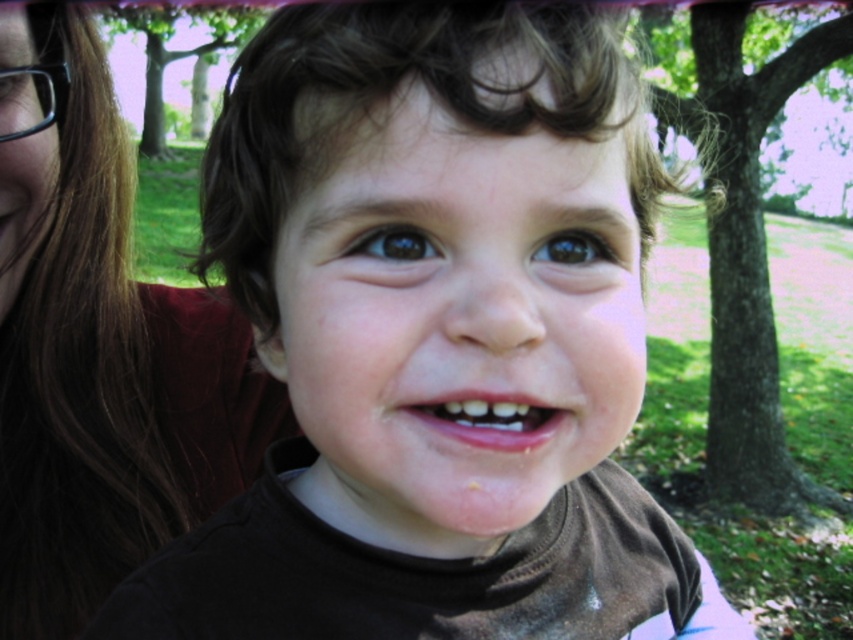
Is brown hair at upper left thinner than brown matte eye at upper left?

No, brown hair at upper left is not thinner than brown matte eye at upper left.

What do you see at coordinates (103, 371) in the screenshot? I see `brown hair at upper left` at bounding box center [103, 371].

Locate an element on the screen. The image size is (853, 640). brown hair at upper left is located at coordinates (103, 371).

Is pink matte mouth at center thinner than brown glossy eye at center?

Correct, pink matte mouth at center's width is less than brown glossy eye at center's.

Which is more to the left, pink matte mouth at center or brown glossy eye at center?

pink matte mouth at center is more to the left.

Is point (9, 202) positioned before point (552, 241)?

That is False.

You are a GUI agent. You are given a task and a screenshot of the screen. Output one action in this format:
    pyautogui.click(x=<x>, y=<y>)
    Task: Click on the pink matte mouth at center
    The image size is (853, 640).
    Given the screenshot: What is the action you would take?
    point(12,228)

In order to click on black matte glasses at upper left in this screenshot , I will do `click(22, 148)`.

Can you confirm if black matte glasses at upper left is taller than brown matte eye at upper left?

Correct, black matte glasses at upper left is much taller as brown matte eye at upper left.

Locate an element on the screen. This screenshot has width=853, height=640. black matte glasses at upper left is located at coordinates (22, 148).